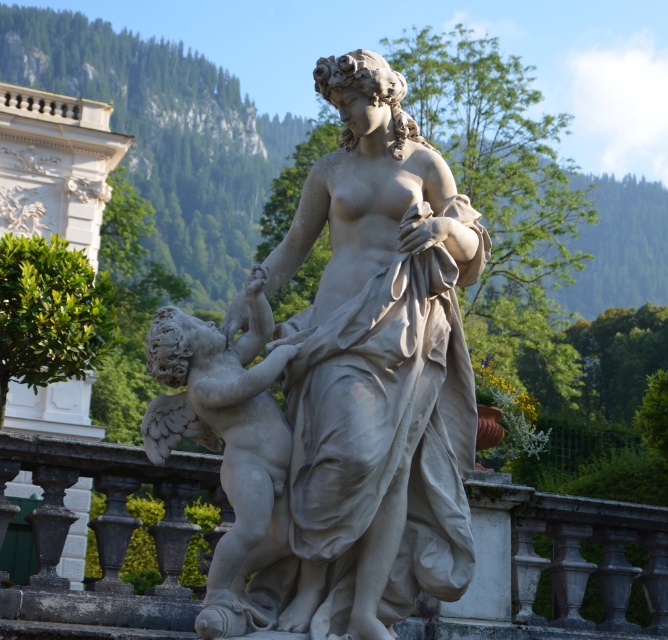
Question: Which point is farther from the camera taking this photo?

Choices:
 (A) (371, 294)
 (B) (156, 435)
 (C) (629, 593)

Answer: (C)

Question: Among these points, which one is nearest to the camera?

Choices:
 (A) (305, 310)
 (B) (240, 422)

Answer: (B)

Question: Is white stone railing at center positioned before white marble cherub at center?

Choices:
 (A) yes
 (B) no

Answer: (B)

Question: Can you confirm if white marble statue at center is smaller than white marble cherub at center?

Choices:
 (A) yes
 (B) no

Answer: (A)

Question: Is white marble statue at center above white stone railing at center?

Choices:
 (A) no
 (B) yes

Answer: (B)

Question: Which point appears closest to the camera in this image?

Choices:
 (A) (166, 445)
 (B) (287, 627)

Answer: (B)